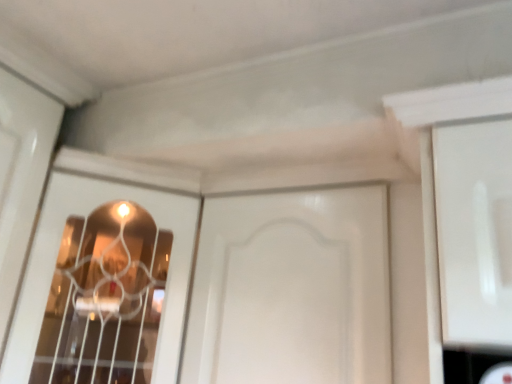
Image resolution: width=512 pixels, height=384 pixels. What do you see at coordinates (291, 289) in the screenshot?
I see `white glossy door at center` at bounding box center [291, 289].

Where is `white glossy door at center`? white glossy door at center is located at coordinates (291, 289).

At what (x,y) coordinates should I click in order to perform the action: click on white glossy door at center. Please return your answer as a coordinate pair (x, y). Looking at the image, I should click on (291, 289).